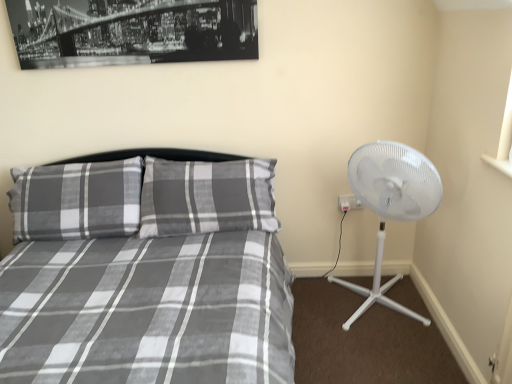
Question: Relative to white plastic electric outlet at right, is gray plaid bed at center in front or behind?

Choices:
 (A) behind
 (B) front

Answer: (B)

Question: From a real-world perspective, relative to white plastic electric outlet at right, is gray plaid bed at center vertically above or below?

Choices:
 (A) below
 (B) above

Answer: (A)

Question: Estimate the real-world distances between objects in this image. Which object is closer to the white plastic electric outlet at right?

Choices:
 (A) gray plaid bed at center
 (B) plaid fabric pillow at left
 (C) black matte print at upper center
 (D) white plastic fan at right

Answer: (D)

Question: Considering the real-world distances, which object is closest to the gray plaid bed at center?

Choices:
 (A) plaid fabric pillow at left
 (B) white plastic fan at right
 (C) black matte print at upper center
 (D) white plastic electric outlet at right

Answer: (A)